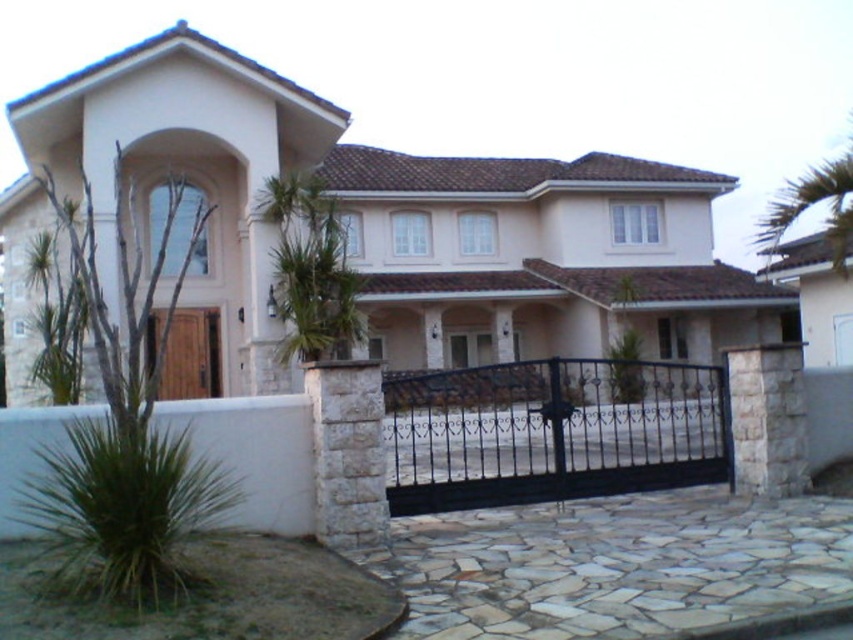
Who is lower down, black wrought iron gate at center or green leafy palm tree at center?

black wrought iron gate at center is lower down.

Does black wrought iron gate at center have a lesser height compared to green leafy palm tree at center?

Yes, black wrought iron gate at center is shorter than green leafy palm tree at center.

This screenshot has height=640, width=853. In order to click on black wrought iron gate at center in this screenshot , I will do `click(550, 432)`.

Between point (677, 593) and point (318, 262), which one is positioned in front?

Point (677, 593) is in front.

Looking at this image, between natural stone driveway at center and green leafy palm tree at center, which one has less height?

Standing shorter between the two is natural stone driveway at center.

I want to click on natural stone driveway at center, so click(614, 564).

Looking at this image, is natural stone driveway at center shorter than black wrought iron gate at center?

Yes.

Image resolution: width=853 pixels, height=640 pixels. What do you see at coordinates (614, 564) in the screenshot?
I see `natural stone driveway at center` at bounding box center [614, 564].

The height and width of the screenshot is (640, 853). I want to click on natural stone driveway at center, so click(614, 564).